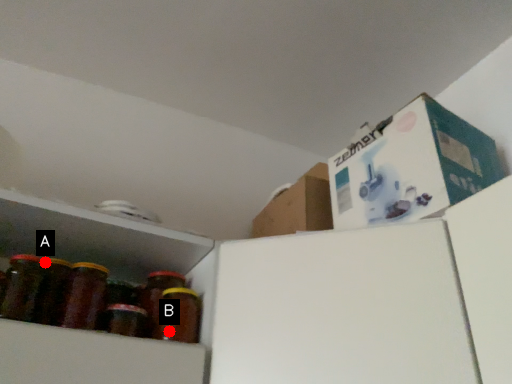
Question: Two points are circled on the image, labeled by A and B beside each circle. Which of the following is the closest to the observer?

Choices:
 (A) A is closer
 (B) B is closer

Answer: (A)